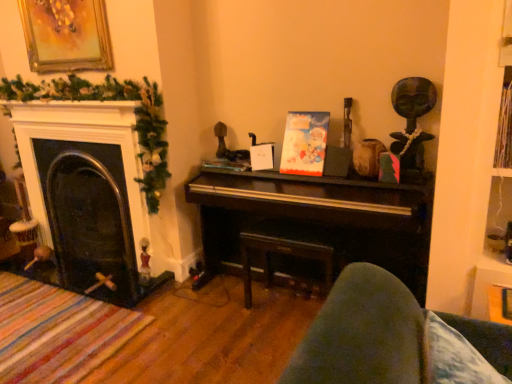
Question: From a real-world perspective, is shiny dark wood piano at center on dark wood table at center?

Choices:
 (A) no
 (B) yes

Answer: (B)

Question: Considering the relative sizes of shiny dark wood piano at center and dark wood table at center in the image provided, is shiny dark wood piano at center thinner than dark wood table at center?

Choices:
 (A) no
 (B) yes

Answer: (A)

Question: Is shiny dark wood piano at center in contact with dark wood table at center?

Choices:
 (A) yes
 (B) no

Answer: (B)

Question: From the image's perspective, is shiny dark wood piano at center over dark wood table at center?

Choices:
 (A) no
 (B) yes

Answer: (B)

Question: From a real-world perspective, is shiny dark wood piano at center located beneath dark wood table at center?

Choices:
 (A) yes
 (B) no

Answer: (B)

Question: Is dark wood table at center located within shiny dark wood piano at center?

Choices:
 (A) no
 (B) yes

Answer: (B)

Question: Could you tell me if gold-framed painting at upper left is facing shiny dark wood piano at center?

Choices:
 (A) no
 (B) yes

Answer: (A)

Question: Does gold-framed painting at upper left have a lesser width compared to shiny dark wood piano at center?

Choices:
 (A) no
 (B) yes

Answer: (B)

Question: Is gold-framed painting at upper left positioned with its back to shiny dark wood piano at center?

Choices:
 (A) yes
 (B) no

Answer: (B)

Question: Is gold-framed painting at upper left smaller than shiny dark wood piano at center?

Choices:
 (A) no
 (B) yes

Answer: (B)

Question: Is gold-framed painting at upper left directly adjacent to shiny dark wood piano at center?

Choices:
 (A) yes
 (B) no

Answer: (B)

Question: Can you confirm if gold-framed painting at upper left is wider than shiny dark wood piano at center?

Choices:
 (A) yes
 (B) no

Answer: (B)

Question: Is black glass fireplace at left in front of shiny dark wood piano at center?

Choices:
 (A) yes
 (B) no

Answer: (B)